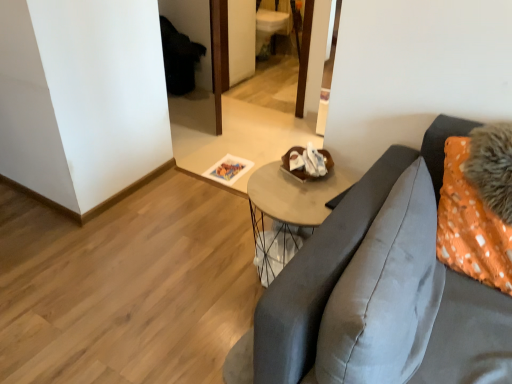
Locate an element on the screen. free space that is to the left of wooden round table at center is located at coordinates (205, 270).